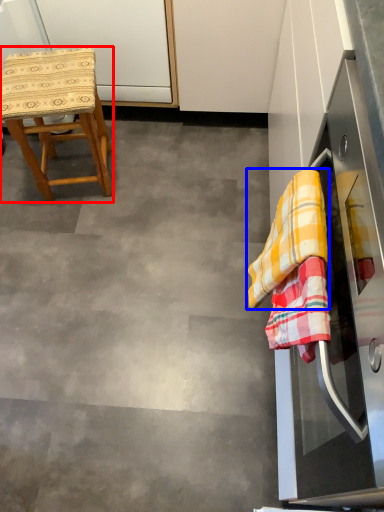
Question: Which point is further to the camera, stool (highlighted by a red box) or clothe (highlighted by a blue box)?

Choices:
 (A) stool
 (B) clothe

Answer: (A)